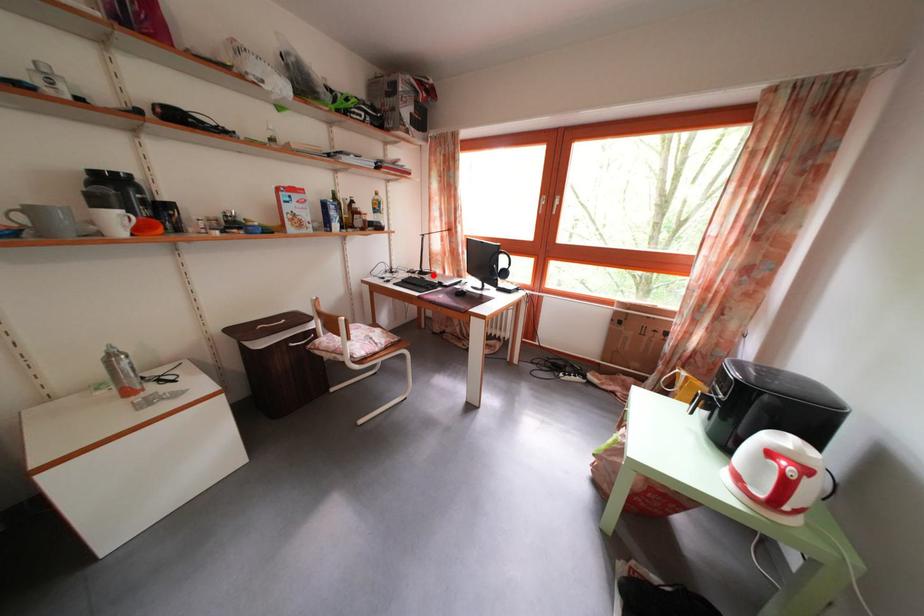
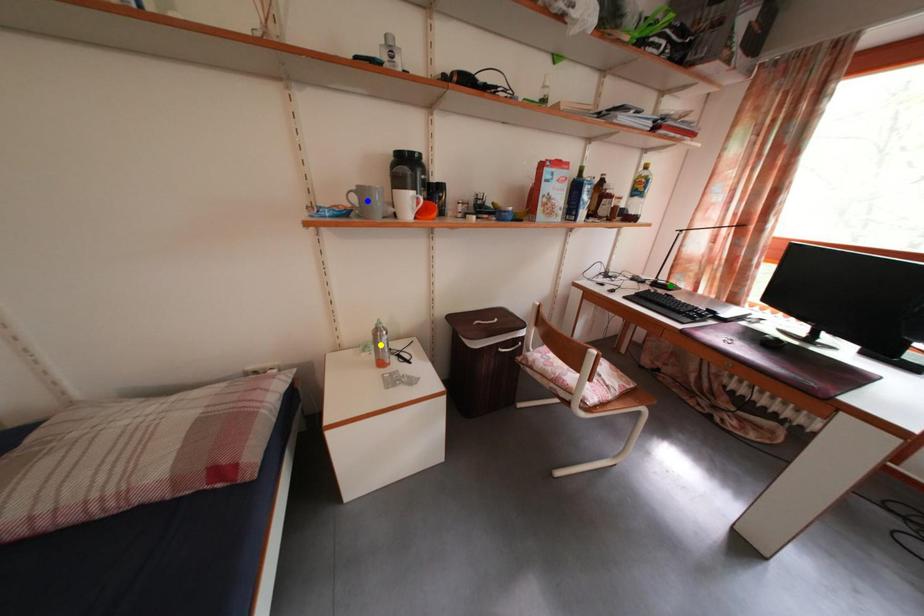
Question: I am providing you with two images of the same scene from different viewpoints. A red point is marked on the first image. You are given multiple points on the second image. Which point in image 2 is actually the same real-world point as the red point in image 1?

Choices:
 (A) green point
 (B) blue point
 (C) yellow point

Answer: (A)